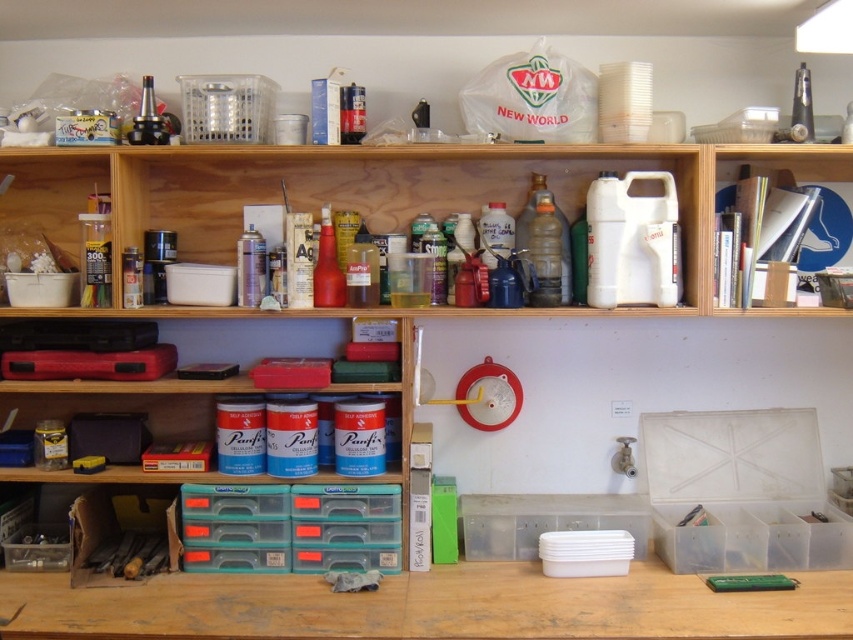
You are organizing the workshop and want to move the matte plastic container at left to a higher shelf. Which shelf should you place it on to avoid it being under the wooden bookshelf at upper right?

You should place the matte plastic container at left on a shelf above the wooden bookshelf at upper right to ensure it is no longer positioned under it.

Consider the image. You are a delivery person who needs to place a new box that is 5 feet long in the workshop. You see the matte plastic container at left and the wooden bookshelf at upper right. Can you fit the box between them?

The matte plastic container at left and the wooden bookshelf at upper right are 5.39 feet apart from each other. Since the box is 5 feet long, it can fit between them with some space to spare.

You are organizing items in the workshop and need to place a new tool on the wooden bookshelf at upper right. However, there is a matte red spray can at center in the way. Based on their positions, can you move the spray can to access the shelf?

The wooden bookshelf at upper right is in front of the matte red spray can at center, meaning the spray can is behind the shelf. Therefore, you cannot directly access the spray can to move it without first moving items from the shelf.